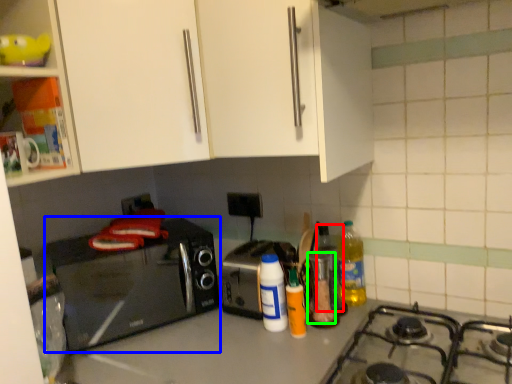
Question: Which object is the farthest from bottle (highlighted by a red box)? Choose among these: home appliance (highlighted by a blue box) or appliance (highlighted by a green box).

Choices:
 (A) home appliance
 (B) appliance

Answer: (A)